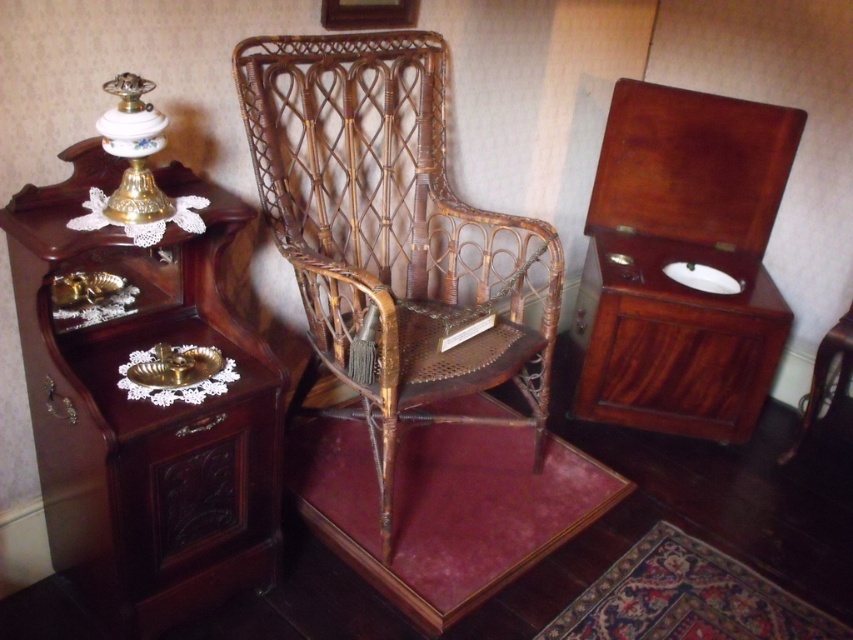
Find the location of `mahogany wood side table at left`. mahogany wood side table at left is located at coordinates (144, 408).

Between mahogany wood side table at left and woven brown cane chair at center, which one has less height?

With less height is mahogany wood side table at left.

Does point (93, 580) come farther from viewer compared to point (384, 497)?

No, (93, 580) is in front of (384, 497).

At what (x,y) coordinates should I click in order to perform the action: click on mahogany wood side table at left. Please return your answer as a coordinate pair (x, y). Looking at the image, I should click on (144, 408).